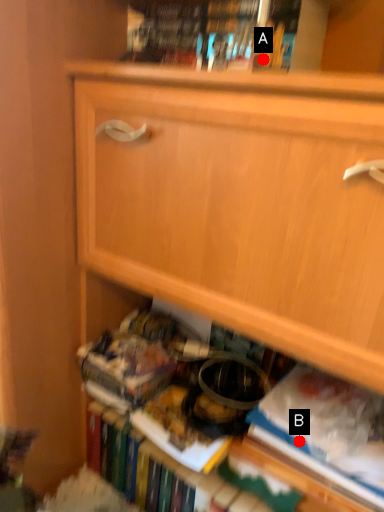
Question: Two points are circled on the image, labeled by A and B beside each circle. Which point is closer to the camera?

Choices:
 (A) A is closer
 (B) B is closer

Answer: (A)